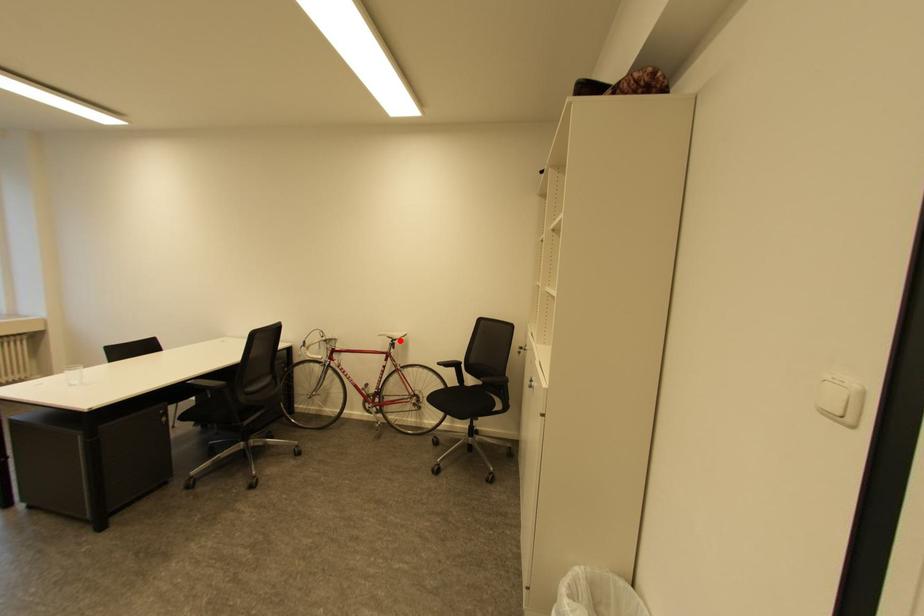
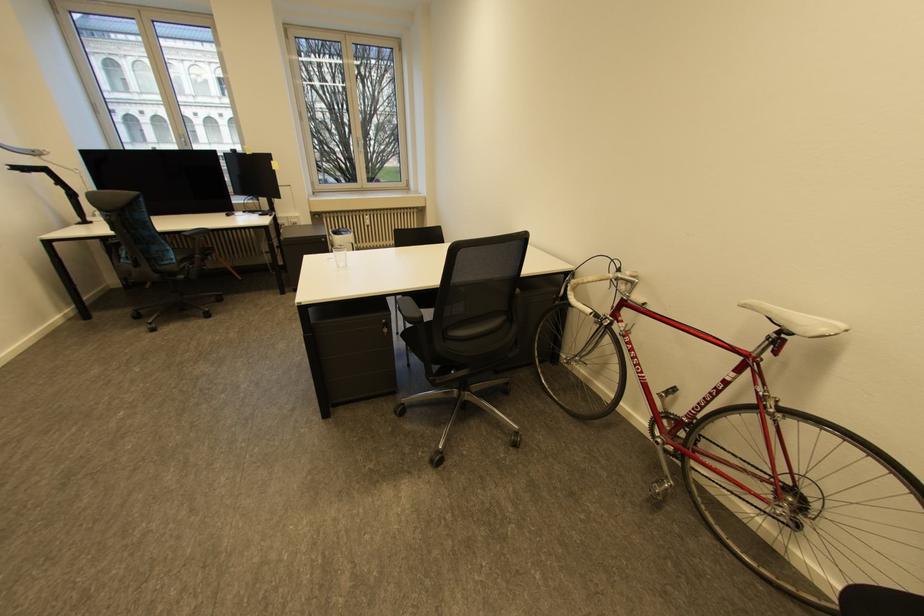
Question: I am providing you with two images of the same scene from different viewpoints. A red point is marked on the first image. Can you still see the location of the red point in image 2?

Choices:
 (A) Yes
 (B) No

Answer: (A)